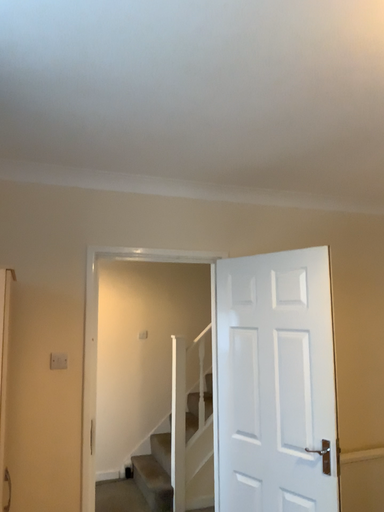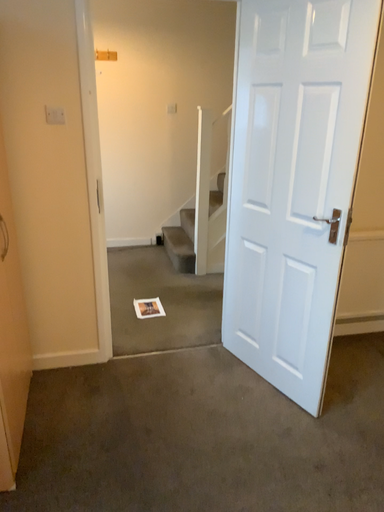
Question: Which way did the camera rotate in the video?

Choices:
 (A) rotated downward
 (B) rotated upward

Answer: (A)